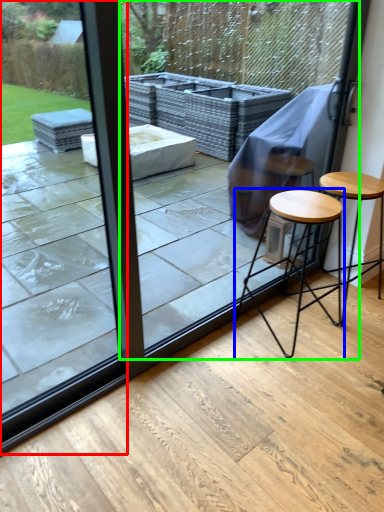
Question: Which is farther away from glass door (highlighted by a red box)? stool (highlighted by a blue box) or screen door (highlighted by a green box)?

Choices:
 (A) stool
 (B) screen door

Answer: (B)